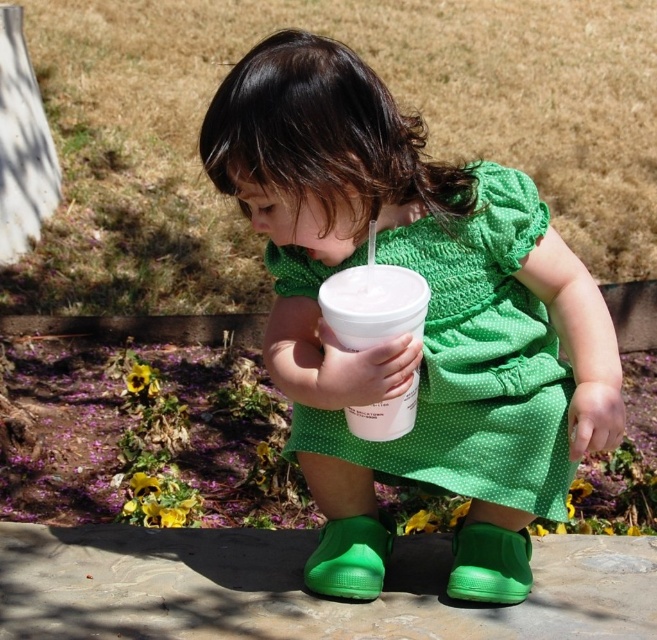
The child is wearing a green dotted dress at center and holding a white plastic cup at center. Which item is wider?

The green dotted dress at center is wider than the white plastic cup at center.

The child is wearing a green dotted dress at center and holding a white plastic cup at center. Which item takes up more space visually?

The green dotted dress at center has a larger size compared to the white plastic cup at center, so the green dotted dress at center takes up more space visually.